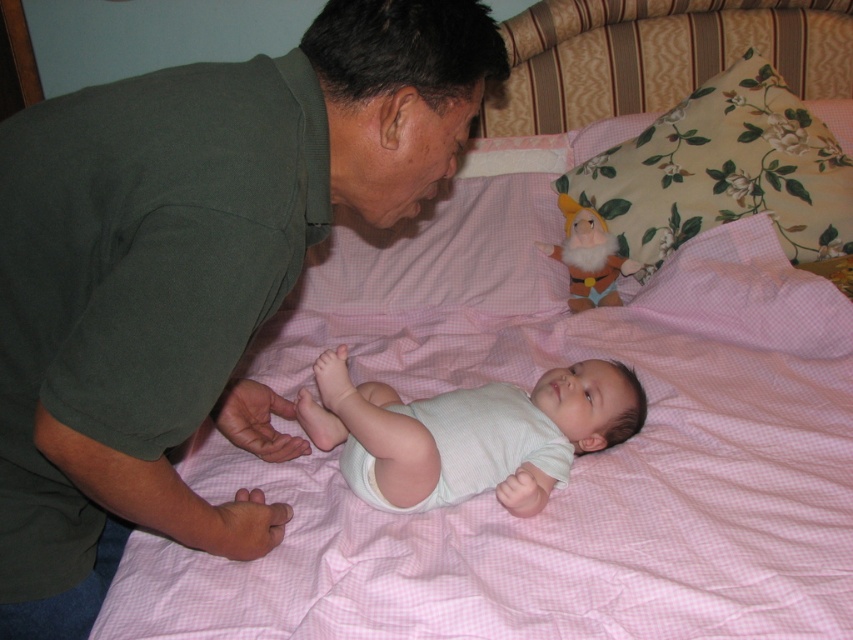
Question: Can you confirm if green matte shirt at upper left is positioned above white ribbed onesie at center?

Choices:
 (A) yes
 (B) no

Answer: (A)

Question: Among these objects, which one is farthest from the camera?

Choices:
 (A) white ribbed onesie at center
 (B) green matte shirt at upper left
 (C) floral fabric pillow at upper right
 (D) white cloth diaper at center

Answer: (C)

Question: Is green matte shirt at upper left thinner than white cloth diaper at center?

Choices:
 (A) yes
 (B) no

Answer: (B)

Question: Which of the following is the farthest from the observer?

Choices:
 (A) 54,392
 (B) 459,429
 (C) 444,480
 (D) 753,145

Answer: (D)

Question: Which is nearer to the white cloth diaper at center?

Choices:
 (A) green matte shirt at upper left
 (B) white ribbed onesie at center
 (C) floral fabric pillow at upper right

Answer: (B)

Question: Is floral fabric pillow at upper right to the left of white ribbed onesie at center from the viewer's perspective?

Choices:
 (A) no
 (B) yes

Answer: (A)